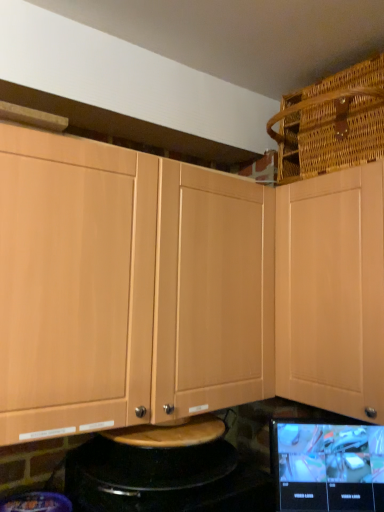
Question: In terms of height, does light wood cabinet at upper left, placed as the 1th cabinetry when sorted from left to right, look taller or shorter compared to woven brown basket at upper right?

Choices:
 (A) short
 (B) tall

Answer: (B)

Question: Considering their positions, is light wood cabinet at upper left, placed as the 1th cabinetry when sorted from left to right, located in front of or behind woven brown basket at upper right?

Choices:
 (A) front
 (B) behind

Answer: (A)

Question: Which of these objects is positioned closest to the light wood cabinet at upper left, which appears as the 2th cabinetry when viewed from the right?

Choices:
 (A) matte black tablet at lower right
 (B) woven brown basket at upper right
 (C) light wood cabinet at upper right, positioned as the 1th cabinetry in right-to-left order

Answer: (C)

Question: Estimate the real-world distances between objects in this image. Which object is farther from the woven brown basket at upper right?

Choices:
 (A) matte black tablet at lower right
 (B) light wood cabinet at upper right, positioned as the 1th cabinetry in right-to-left order
 (C) light wood cabinet at upper left, placed as the 1th cabinetry when sorted from left to right

Answer: (A)